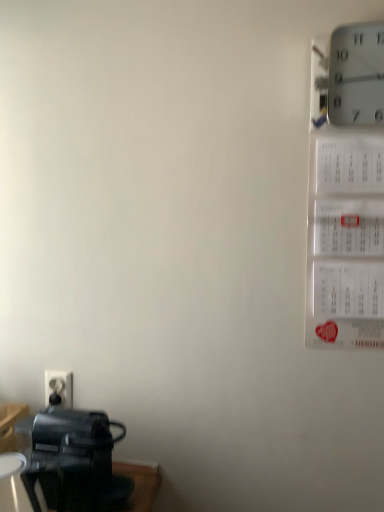
Question: Is white plastic wall clock at upper right to the right of black plastic coffee maker at lower left from the viewer's perspective?

Choices:
 (A) yes
 (B) no

Answer: (A)

Question: Is white plastic wall clock at upper right at the left side of black plastic coffee maker at lower left?

Choices:
 (A) no
 (B) yes

Answer: (A)

Question: Is white plastic wall clock at upper right smaller than black plastic coffee maker at lower left?

Choices:
 (A) no
 (B) yes

Answer: (B)

Question: Are white plastic wall clock at upper right and black plastic coffee maker at lower left far apart?

Choices:
 (A) yes
 (B) no

Answer: (A)

Question: Is white plastic wall clock at upper right behind black plastic coffee maker at lower left?

Choices:
 (A) no
 (B) yes

Answer: (A)

Question: From the image's perspective, is white plastic wall clock at upper right below black plastic coffee maker at lower left?

Choices:
 (A) no
 (B) yes

Answer: (A)

Question: From the image's perspective, is white plastic wall clock at upper right on white plastic electric outlet at lower left?

Choices:
 (A) no
 (B) yes

Answer: (B)

Question: Considering the relative sizes of white plastic wall clock at upper right and white plastic electric outlet at lower left in the image provided, is white plastic wall clock at upper right taller than white plastic electric outlet at lower left?

Choices:
 (A) yes
 (B) no

Answer: (A)

Question: Can you confirm if white plastic wall clock at upper right is wider than white plastic electric outlet at lower left?

Choices:
 (A) yes
 (B) no

Answer: (A)

Question: Is white plastic wall clock at upper right bigger than white plastic electric outlet at lower left?

Choices:
 (A) yes
 (B) no

Answer: (A)

Question: Is white plastic wall clock at upper right positioned with its back to white plastic electric outlet at lower left?

Choices:
 (A) no
 (B) yes

Answer: (A)

Question: Is white plastic wall clock at upper right completely or partially outside of white plastic electric outlet at lower left?

Choices:
 (A) no
 (B) yes

Answer: (B)

Question: Considering the relative positions of white plastic electric outlet at lower left and white plastic wall clock at upper right in the image provided, is white plastic electric outlet at lower left to the right of white plastic wall clock at upper right from the viewer's perspective?

Choices:
 (A) no
 (B) yes

Answer: (A)